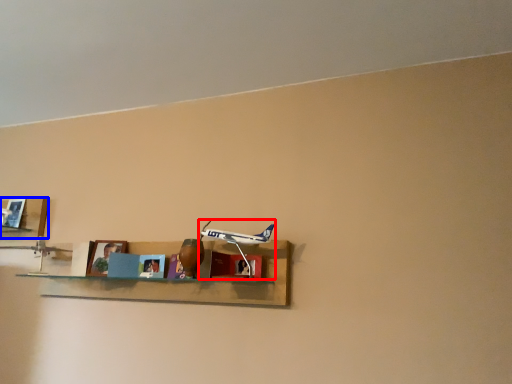
Question: Which of the following is the closest to the observer, toy (highlighted by a red box) or shelf (highlighted by a blue box)?

Choices:
 (A) toy
 (B) shelf

Answer: (A)